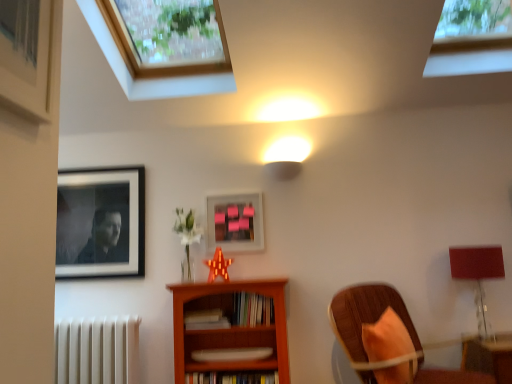
What is the approximate width of pink matte picture frame at center, which is counted as the 1th picture frame, starting from the right?

pink matte picture frame at center, which is counted as the 1th picture frame, starting from the right, is 1.29 inches wide.

Measure the distance between point (497,67) and camera.

They are 9.33 feet apart.

Find the location of a particular element. Image resolution: width=512 pixels, height=384 pixels. white matte book at center, the 2th book when ordered from top to bottom is located at coordinates (206, 320).

In order to face hardcover book at center, which is the first book from bottom to top, should I rotate leftwards or rightwards?

Answer: To face it directly, rotate left by 2.749 degrees.

Locate an element on the screen. wooden bookcase at center is located at coordinates [229, 328].

At what (x,y) coordinates should I click in order to perform the action: click on matte red table lamp at right. Please return your answer as a coordinate pair (x, y). Looking at the image, I should click on (477, 270).

Looking at this image, from a real-world perspective, is hardcover book at center, positioned as the third book in top-to-bottom order, under wooden frame window at upper left, the 2th window in the right-to-left sequence?

Yes.

Does point (271, 377) appear closer or farther from the camera than point (125, 86)?

Point (271, 377) is closer to the camera than point (125, 86).

Is wooden frame window at upper left, the 2th window in the right-to-left sequence, at the back of hardcover book at center, positioned as the third book in top-to-bottom order?

That's not correct — hardcover book at center, positioned as the third book in top-to-bottom order, is not looking away from wooden frame window at upper left, the 2th window in the right-to-left sequence.

Can you confirm if hardcover book at center, which is the first book from bottom to top, is shorter than wooden frame window at upper left, the 2th window in the right-to-left sequence?

Yes, hardcover book at center, which is the first book from bottom to top, is shorter than wooden frame window at upper left, the 2th window in the right-to-left sequence.

Is white matte radiator at lower left looking in the opposite direction of clear glass window at upper right, the first window positioned from the right?

No.

Is white matte radiator at lower left not inside clear glass window at upper right, the 2th window in the left-to-right sequence?

Indeed, white matte radiator at lower left is completely outside clear glass window at upper right, the 2th window in the left-to-right sequence.

Would you say white matte radiator at lower left is a long distance from clear glass window at upper right, the 2th window in the left-to-right sequence?

white matte radiator at lower left is positioned a significant distance from clear glass window at upper right, the 2th window in the left-to-right sequence.

Is white matte radiator at lower left to the left of clear glass window at upper right, the first window positioned from the right, from the viewer's perspective?

Yes.

Is hardcover book at center, positioned as the third book in top-to-bottom order, in contact with clear glass window at upper right, the 2th window in the left-to-right sequence?

No, hardcover book at center, positioned as the third book in top-to-bottom order, is not in contact with clear glass window at upper right, the 2th window in the left-to-right sequence.

Would you say hardcover book at center, positioned as the third book in top-to-bottom order, is inside or outside clear glass window at upper right, the first window positioned from the right?

hardcover book at center, positioned as the third book in top-to-bottom order, cannot be found inside clear glass window at upper right, the first window positioned from the right.

You are a GUI agent. You are given a task and a screenshot of the screen. Output one action in this format:
    pyautogui.click(x=<x>, y=<y>)
    Task: Click on the book that is the 1st object located behind the clear glass window at upper right, the 2th window in the left-to-right sequence
    The image size is (512, 384).
    Given the screenshot: What is the action you would take?
    pyautogui.click(x=231, y=378)

In terms of height, does hardcover book at center, which is the first book from bottom to top, look taller or shorter compared to clear glass window at upper right, the 2th window in the left-to-right sequence?

hardcover book at center, which is the first book from bottom to top, is shorter than clear glass window at upper right, the 2th window in the left-to-right sequence.

Image resolution: width=512 pixels, height=384 pixels. What are the coordinates of `the 2nd picture frame to the left of the clear glass window at upper right, the 2th window in the left-to-right sequence, counting from the anchor's position` in the screenshot? It's located at (100, 222).

Considering the sizes of black matte portrait at upper left, which is the 1th picture frame from left to right, and clear glass window at upper right, the 2th window in the left-to-right sequence, in the image, is black matte portrait at upper left, which is the 1th picture frame from left to right, wider or thinner than clear glass window at upper right, the 2th window in the left-to-right sequence,?

In the image, black matte portrait at upper left, which is the 1th picture frame from left to right, appears to be more narrow than clear glass window at upper right, the 2th window in the left-to-right sequence.

Is clear glass window at upper right, the first window positioned from the right, inside black matte portrait at upper left, placed as the 2th picture frame when sorted from right to left?

Definitely not — clear glass window at upper right, the first window positioned from the right, is not inside black matte portrait at upper left, placed as the 2th picture frame when sorted from right to left.

Is clear glass window at upper right, the first window positioned from the right, at the back of black matte portrait at upper left, which is the 1th picture frame from left to right?

No, black matte portrait at upper left, which is the 1th picture frame from left to right,'s orientation is not away from clear glass window at upper right, the first window positioned from the right.

Considering the relative sizes of clear glass window at upper right, the 2th window in the left-to-right sequence, and wooden frame window at upper left, the 2th window in the right-to-left sequence, in the image provided, is clear glass window at upper right, the 2th window in the left-to-right sequence, bigger than wooden frame window at upper left, the 2th window in the right-to-left sequence,?

No.

Does clear glass window at upper right, the 2th window in the left-to-right sequence, turn towards wooden frame window at upper left, which appears as the first window when viewed from the left?

No.

In order to click on window to the left of clear glass window at upper right, the 2th window in the left-to-right sequence in this screenshot , I will do `click(153, 78)`.

Considering the sizes of objects wooden bookcase at center and clear glass window at upper right, the 2th window in the left-to-right sequence, in the image provided, who is taller, wooden bookcase at center or clear glass window at upper right, the 2th window in the left-to-right sequence,?

With more height is wooden bookcase at center.

Which is less distant, (245, 283) or (486, 33)?

Clearly, point (245, 283) is closer to the camera than point (486, 33).

Is wooden bookcase at center next to clear glass window at upper right, the first window positioned from the right?

wooden bookcase at center and clear glass window at upper right, the first window positioned from the right, are not in contact.

From the image's perspective, is white matte book at center, marked as the second book in a bottom-to-top arrangement, below wooden chair with orange cushion at lower right?

Incorrect, from the image's perspective, white matte book at center, marked as the second book in a bottom-to-top arrangement, is higher than wooden chair with orange cushion at lower right.

Considering their positions, is white matte book at center, marked as the second book in a bottom-to-top arrangement, located in front of or behind wooden chair with orange cushion at lower right?

Clearly, white matte book at center, marked as the second book in a bottom-to-top arrangement, is behind wooden chair with orange cushion at lower right.

I want to click on the 3rd book to the left of the wooden chair with orange cushion at lower right, counting from the anchor's position, so click(206, 320).

The height and width of the screenshot is (384, 512). What are the coordinates of `window that is the 2nd object located in front of the hardcover book at center, positioned as the third book in top-to-bottom order` in the screenshot? It's located at (153, 78).

From a real-world perspective, starting from the white matte radiator at lower left, which window is the 1st one vertically above it? Please provide its 2D coordinates.

[(472, 38)]

Looking at the image, which one is located closer to hardcover book at center, which is the first book from bottom to top, wooden frame window at upper left, the 2th window in the right-to-left sequence, or hardcover books at center, positioned as the third book in bottom-to-top order?

hardcover books at center, positioned as the third book in bottom-to-top order.

Estimate the real-world distances between objects in this image. Which object is closer to white matte book at center, the 2th book when ordered from top to bottom, matte red table lamp at right or hardcover book at center, positioned as the third book in top-to-bottom order?

hardcover book at center, positioned as the third book in top-to-bottom order, is closer to white matte book at center, the 2th book when ordered from top to bottom.

Based on their spatial positions, is wooden frame window at upper left, which appears as the first window when viewed from the left, or matte red table lamp at right further from white matte radiator at lower left?

matte red table lamp at right lies further to white matte radiator at lower left than the other object.

Which object lies further to the anchor point white matte radiator at lower left, white matte book at center, marked as the second book in a bottom-to-top arrangement, or hardcover books at center, the first book viewed from the top?

hardcover books at center, the first book viewed from the top.

Considering their positions, is hardcover books at center, the first book viewed from the top, positioned closer to matte red table lamp at right than wooden frame window at upper left, which appears as the first window when viewed from the left?

hardcover books at center, the first book viewed from the top.

In the scene shown: Estimate the real-world distances between objects in this image. Which object is closer to hardcover books at center, the first book viewed from the top, wooden frame window at upper left, the 2th window in the right-to-left sequence, or wooden chair with orange cushion at lower right?

wooden chair with orange cushion at lower right is positioned closer to the anchor hardcover books at center, the first book viewed from the top.

Considering their positions, is white matte radiator at lower left positioned further to wooden bookcase at center than matte red table lamp at right?

matte red table lamp at right.

Consider the image. Based on their spatial positions, is wooden chair with orange cushion at lower right or black matte portrait at upper left, which is the 1th picture frame from left to right, closer to pink matte picture frame at center, which is counted as the 1th picture frame, starting from the right?

The object closer to pink matte picture frame at center, which is counted as the 1th picture frame, starting from the right, is black matte portrait at upper left, which is the 1th picture frame from left to right.

This screenshot has height=384, width=512. I want to click on book between hardcover book at center, positioned as the third book in top-to-bottom order, and matte red table lamp at right from left to right, so click(252, 309).

Where is `chair between wooden bookcase at center and matte red table lamp at right from left to right`? The width and height of the screenshot is (512, 384). chair between wooden bookcase at center and matte red table lamp at right from left to right is located at coordinates (376, 321).

I want to click on radiator between wooden frame window at upper left, the 2th window in the right-to-left sequence, and hardcover book at center, positioned as the third book in top-to-bottom order, from top to bottom, so click(x=97, y=351).

Image resolution: width=512 pixels, height=384 pixels. I want to click on window between black matte portrait at upper left, placed as the 2th picture frame when sorted from right to left, and wooden chair with orange cushion at lower right, in the horizontal direction, so click(x=153, y=78).